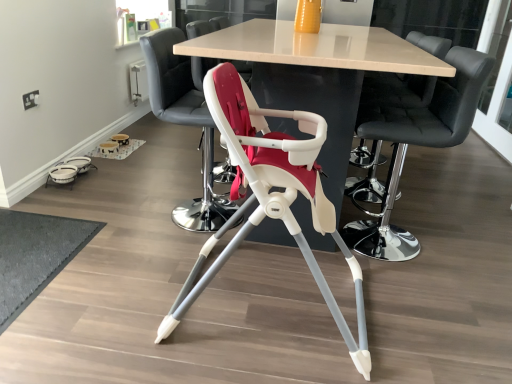
The image size is (512, 384). I want to click on free location to the left of white plastic highchair at center, the 4th chair positioned from the right, so click(x=129, y=208).